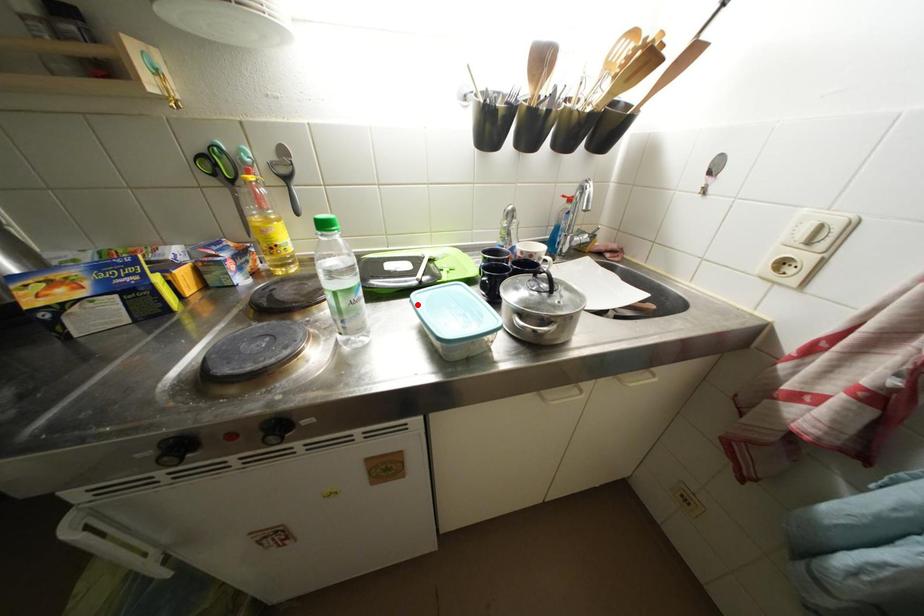
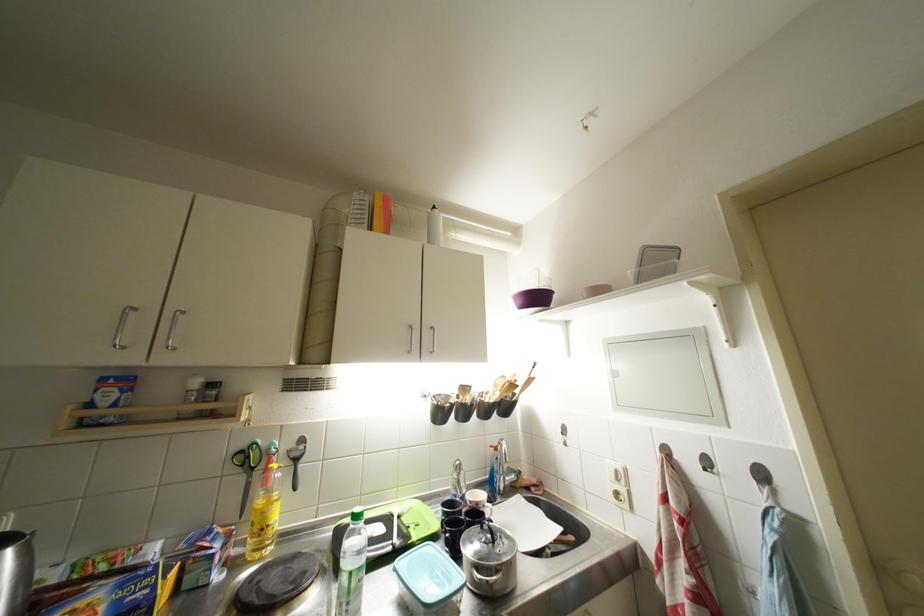
Locate, in the second image, the point that corresponds to the highlighted location in the first image.

(402, 573)